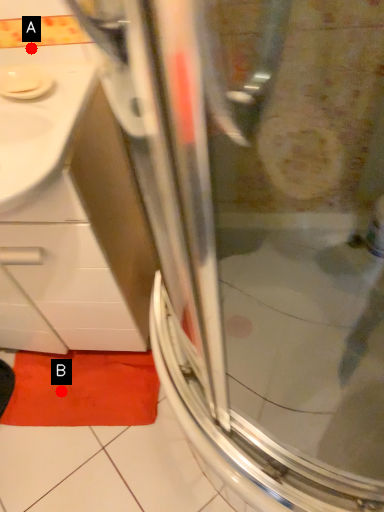
Question: Two points are circled on the image, labeled by A and B beside each circle. Which point is farther to the camera?

Choices:
 (A) A is further
 (B) B is further

Answer: (B)